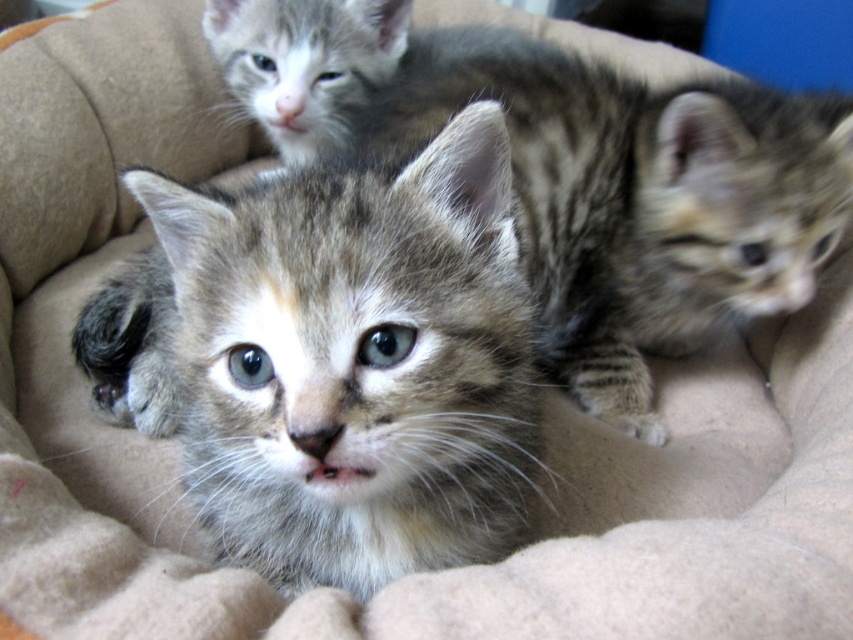
Based on the scene description, where is the gray tabby kitten at center located in terms of its 2D coordinates?

The gray tabby kitten at center is located at the 2D coordinates of point (355, 362).

You are a photographer trying to capture a group photo of the gray tabby kitten at center and the tabby fur kitten at center. Which kitten will appear smaller in the photo?

The gray tabby kitten at center will appear smaller in the photo because it occupies less space than the tabby fur kitten at center.

You are taking a photo of the kittens in the cat bed. You want to focus on the kitten closest to the camera. Which point should you focus on, point [473,144] or point [544,58]?

Point [473,144] is closer to the camera than point [544,58], so you should focus on point [473,144] to capture the kitten closest to the camera.